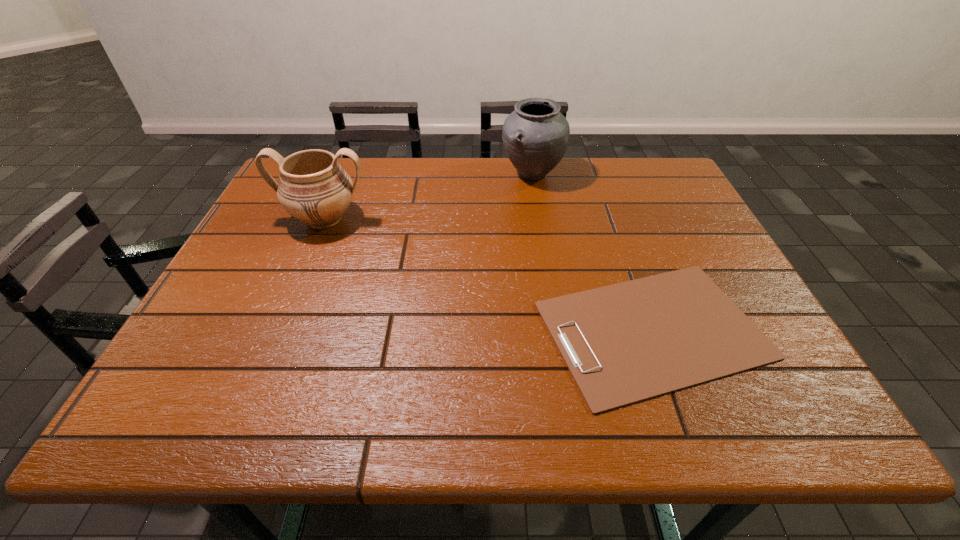
Where is `object that is at the left edge`? object that is at the left edge is located at coordinates (313, 187).

Find the location of a particular element. The image size is (960, 540). object that is at the right edge is located at coordinates (624, 343).

Identify the location of object that is positioned at the far left corner. Image resolution: width=960 pixels, height=540 pixels. (313, 187).

Locate an element on the screen. object that is at the near right corner is located at coordinates (624, 343).

At what (x,y) coordinates should I click in order to perform the action: click on vacant area at the far edge. Please return your answer as a coordinate pair (x, y). Looking at the image, I should click on tap(615, 184).

At what (x,y) coordinates should I click in order to perform the action: click on free region at the near edge. Please return your answer as a coordinate pair (x, y). Looking at the image, I should click on (306, 416).

At what (x,y) coordinates should I click in order to perform the action: click on vacant space at the left edge. Please return your answer as a coordinate pair (x, y). Image resolution: width=960 pixels, height=540 pixels. Looking at the image, I should click on (284, 217).

The height and width of the screenshot is (540, 960). In the image, there is a desktop. Identify the location of vacant space at the right edge. (635, 204).

You are a GUI agent. You are given a task and a screenshot of the screen. Output one action in this format:
    pyautogui.click(x=<x>, y=<y>)
    Task: Click on the vacant space at the far right corner
    
    Given the screenshot: What is the action you would take?
    pyautogui.click(x=641, y=197)

The image size is (960, 540). What are the coordinates of `free point between the second nearest object and the farthest object` in the screenshot? It's located at (428, 197).